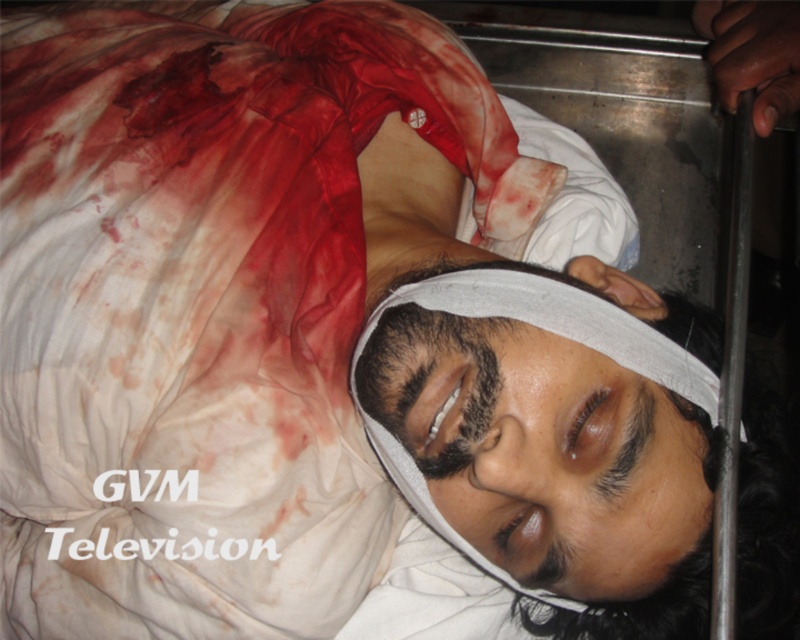
Looking at this image, you are a medical professional assessing the scene. You notice the white bandage at center and the dry skin forehead at center. Based on their sizes, which one is more likely to be covering a wound?

The white bandage at center has a greater height compared to dry skin forehead at center, so it is more likely to be covering a wound since bandages are typically larger in size to adequately cover injuries.

You are a medical professional assessing the patient in this scene. Based on the positioning of the white bandage at center and the dry skin forehead at center, can you determine if the bandage is covering the forehead area?

The white bandage at center is positioned under the dry skin forehead at center, meaning the bandage is covering the forehead area.

You are a paramedic assessing the scene. You notice two critical points marked at coordinates point (566, 316) and point (498, 372). From the perspective of the stretcher, which point is closer to the head of the injured person?

Point (498, 372) is closer to the head of the injured person because it is in front of point (566, 316) according to their positions.